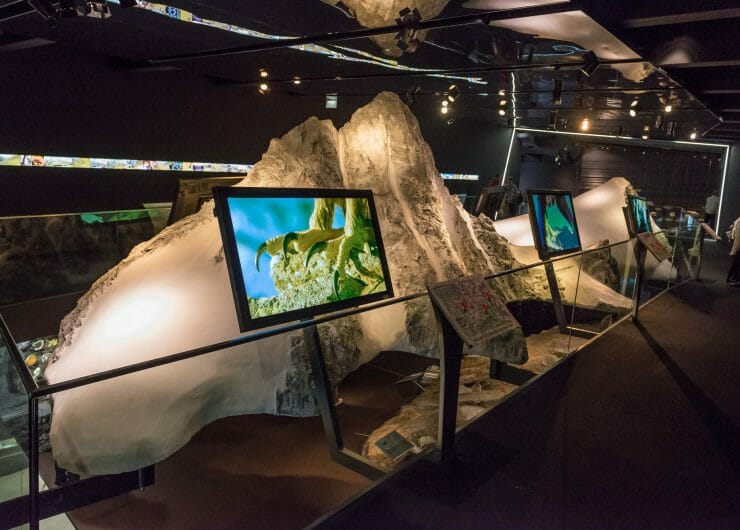
In order to click on display in this screenshot , I will do point(420,214), point(616,203).